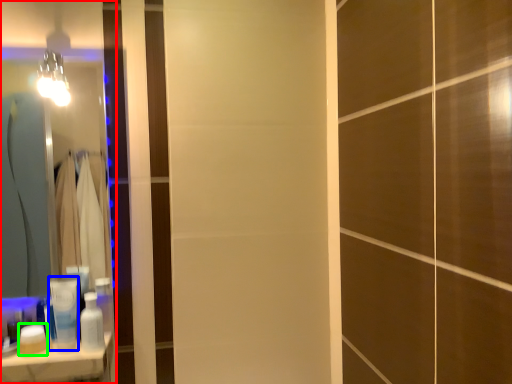
Question: Based on their relative distances, which object is farther from mirror (highlighted by a red box)? Choose from toiletry (highlighted by a blue box) and toiletry (highlighted by a green box).

Choices:
 (A) toiletry
 (B) toiletry

Answer: (B)